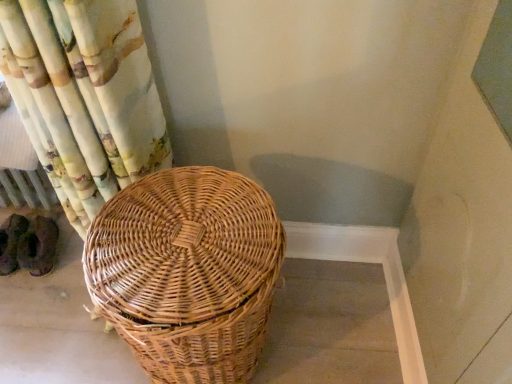
Describe the element at coordinates (188, 272) in the screenshot. Image resolution: width=512 pixels, height=384 pixels. I see `woven brown picnic basket at center` at that location.

Find the location of a particular element. This screenshot has height=384, width=512. woven brown picnic basket at center is located at coordinates (188, 272).

Where is `woven brown picnic basket at center`? woven brown picnic basket at center is located at coordinates (188, 272).